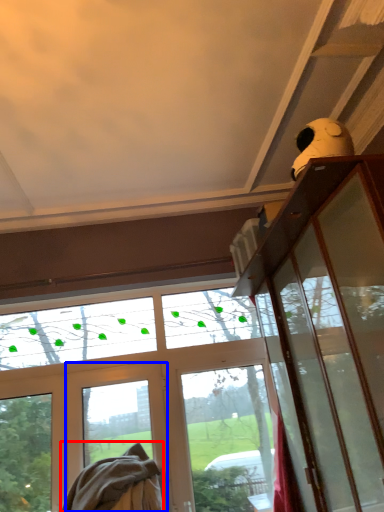
Question: Which point is closer to the camera, blanket (highlighted by a red box) or screen door (highlighted by a blue box)?

Choices:
 (A) blanket
 (B) screen door

Answer: (A)